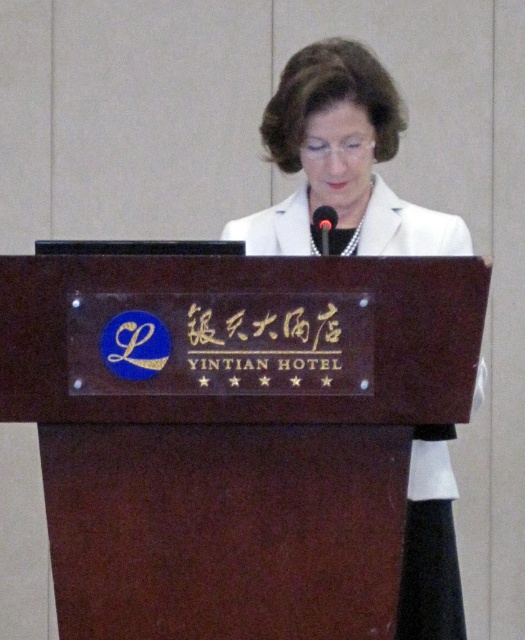
Question: Considering the relative positions of white glossy coat at center and black plastic microphone at center in the image provided, where is white glossy coat at center located with respect to black plastic microphone at center?

Choices:
 (A) below
 (B) above

Answer: (B)

Question: Is brown polished wood podium at center further to camera compared to black glossy text at center?

Choices:
 (A) yes
 (B) no

Answer: (B)

Question: Does black glossy text at center have a greater width compared to black plastic microphone at center?

Choices:
 (A) yes
 (B) no

Answer: (A)

Question: Which of the following is the farthest from the observer?

Choices:
 (A) black plastic microphone at center
 (B) brown polished wood podium at center

Answer: (A)

Question: Which of the following is the farthest from the observer?

Choices:
 (A) white glossy coat at center
 (B) black plastic microphone at center
 (C) black glossy text at center

Answer: (A)

Question: Considering the real-world distances, which object is farthest from the black glossy text at center?

Choices:
 (A) black plastic microphone at center
 (B) white glossy coat at center

Answer: (B)